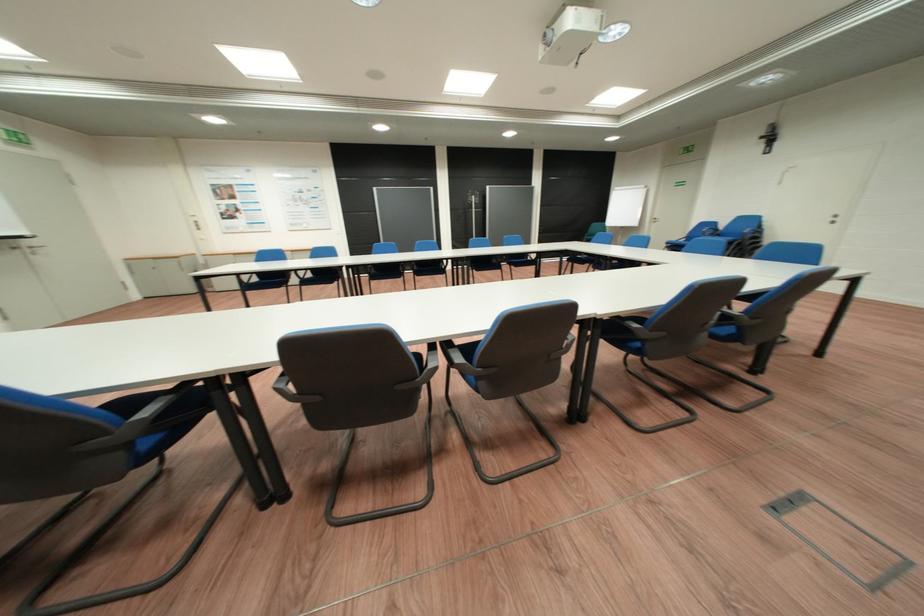
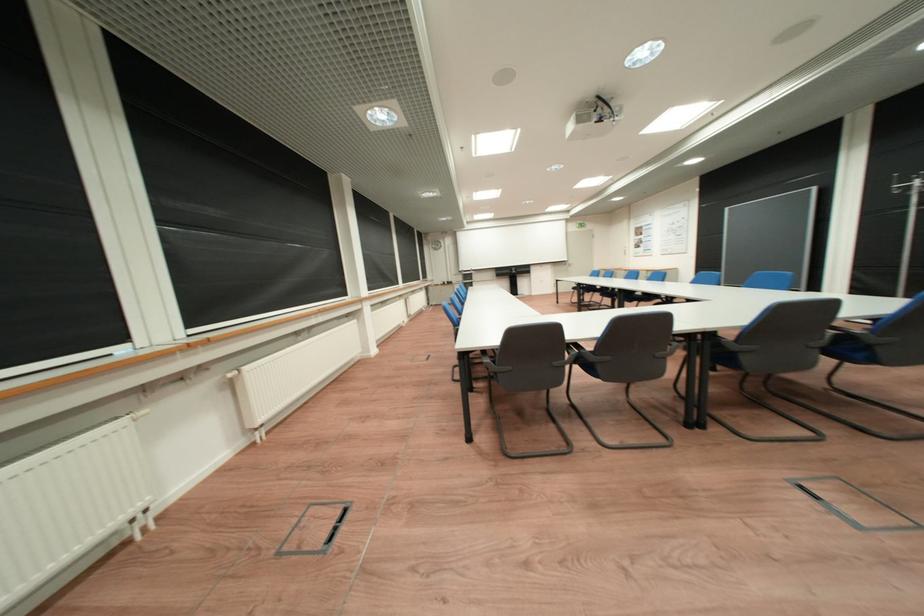
Question: I am providing you with two images of the same scene from different viewpoints. Which of the following objects are not visible in image2?

Choices:
 (A) grey chair armrest
 (B) blue chair armrest
 (C) black chair armrest
 (D) black bin slot

Answer: (C)